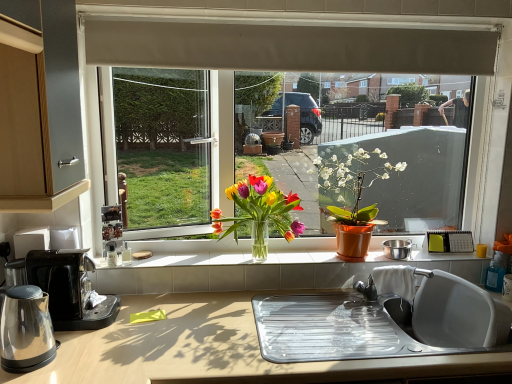
Question: From a real-world perspective, is matte orange pot at center, acting as the 1th houseplant starting from the right, on transparent glass window at center?

Choices:
 (A) yes
 (B) no

Answer: (B)

Question: Is matte orange pot at center, acting as the 1th houseplant starting from the right, aimed at transparent glass window at center?

Choices:
 (A) no
 (B) yes

Answer: (A)

Question: Would you say matte orange pot at center, acting as the 1th houseplant starting from the right, contains transparent glass window at center?

Choices:
 (A) no
 (B) yes

Answer: (A)

Question: Can you confirm if matte orange pot at center, acting as the 1th houseplant starting from the right, is shorter than transparent glass window at center?

Choices:
 (A) no
 (B) yes

Answer: (B)

Question: Considering the relative sizes of matte orange pot at center, which is counted as the second houseplant, starting from the left, and transparent glass window at center in the image provided, is matte orange pot at center, which is counted as the second houseplant, starting from the left, taller than transparent glass window at center?

Choices:
 (A) yes
 (B) no

Answer: (B)

Question: From a real-world perspective, is beige fabric exhaust hood at upper center positioned above or below matte orange pot at center, acting as the 1th houseplant starting from the right?

Choices:
 (A) above
 (B) below

Answer: (A)

Question: Is beige fabric exhaust hood at upper center taller or shorter than matte orange pot at center, which is counted as the second houseplant, starting from the left?

Choices:
 (A) short
 (B) tall

Answer: (A)

Question: Is beige fabric exhaust hood at upper center inside the boundaries of matte orange pot at center, acting as the 1th houseplant starting from the right, or outside?

Choices:
 (A) outside
 (B) inside

Answer: (A)

Question: Is beige fabric exhaust hood at upper center bigger or smaller than matte orange pot at center, acting as the 1th houseplant starting from the right?

Choices:
 (A) big
 (B) small

Answer: (B)

Question: Is matte orange pot at center, which is counted as the second houseplant, starting from the left, taller or shorter than yellow plastic corded phone at right?

Choices:
 (A) short
 (B) tall

Answer: (B)

Question: From the image's perspective, is matte orange pot at center, acting as the 1th houseplant starting from the right, positioned above or below yellow plastic corded phone at right?

Choices:
 (A) below
 (B) above

Answer: (B)

Question: Looking at their shapes, would you say matte orange pot at center, acting as the 1th houseplant starting from the right, is wider or thinner than yellow plastic corded phone at right?

Choices:
 (A) wide
 (B) thin

Answer: (A)

Question: From a real-world perspective, is matte orange pot at center, which is counted as the second houseplant, starting from the left, above or below yellow plastic corded phone at right?

Choices:
 (A) above
 (B) below

Answer: (A)

Question: In terms of height, does shiny metallic kettle at left look taller or shorter compared to translucent glass vase at center, which is the 2th houseplant in right-to-left order?

Choices:
 (A) short
 (B) tall

Answer: (A)

Question: In the image, is shiny metallic kettle at left positioned in front of or behind translucent glass vase at center, which is the 2th houseplant in right-to-left order?

Choices:
 (A) front
 (B) behind

Answer: (A)